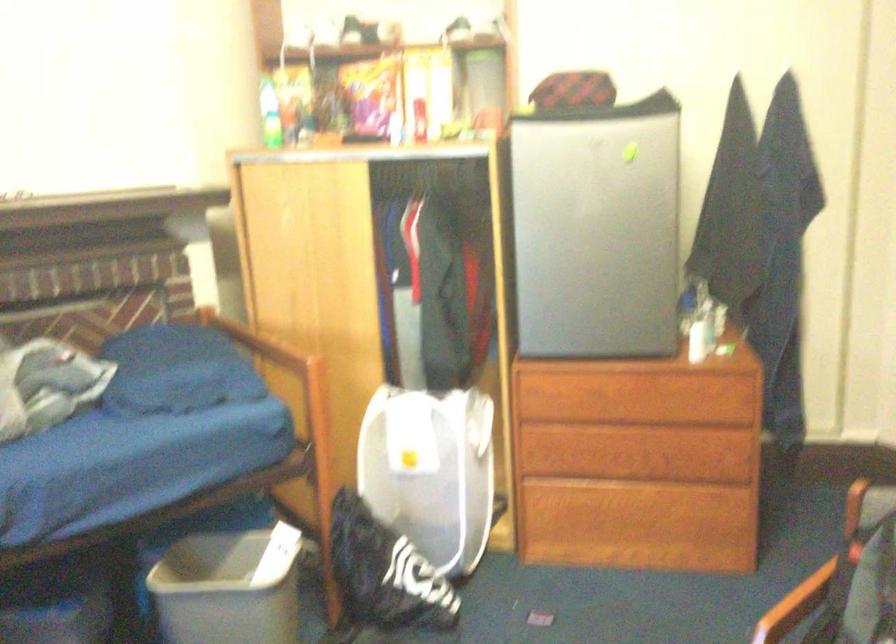
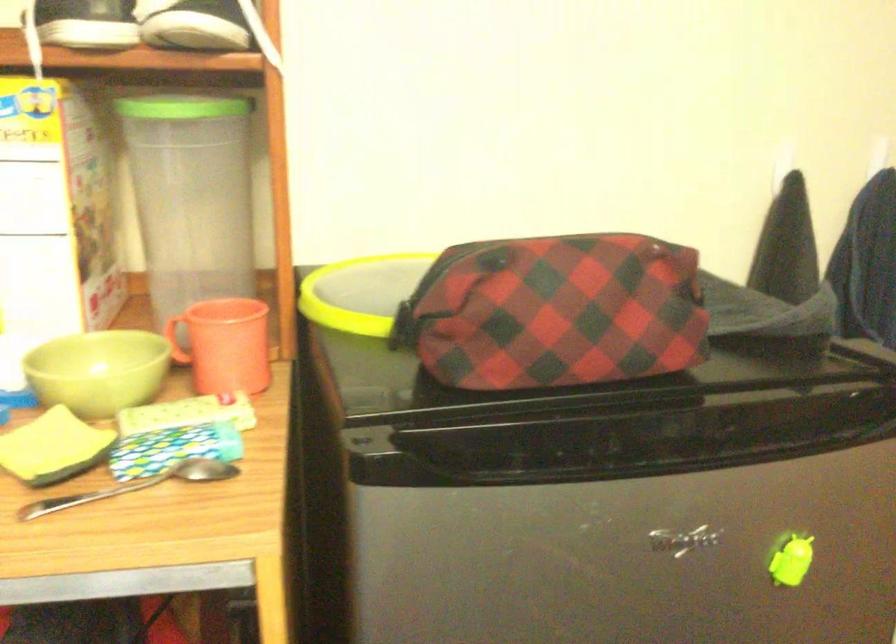
Find the pixel in the second image that matches the point at 571,109 in the first image.

(556, 430)